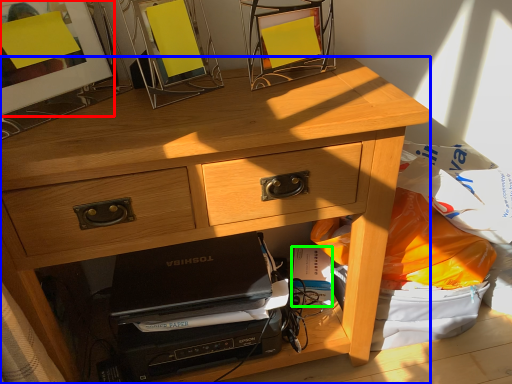
Question: Estimate the real-world distances between objects in this image. Which object is closer to picture frame (highlighted by a red box), desk (highlighted by a blue box) or paperback book (highlighted by a green box)?

Choices:
 (A) desk
 (B) paperback book

Answer: (A)